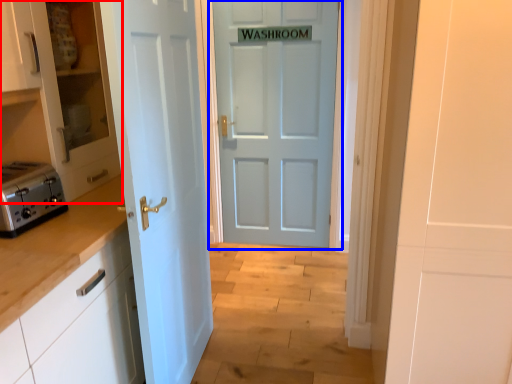
Question: Which point is further to the camera, cabinetry (highlighted by a red box) or door (highlighted by a blue box)?

Choices:
 (A) cabinetry
 (B) door

Answer: (B)